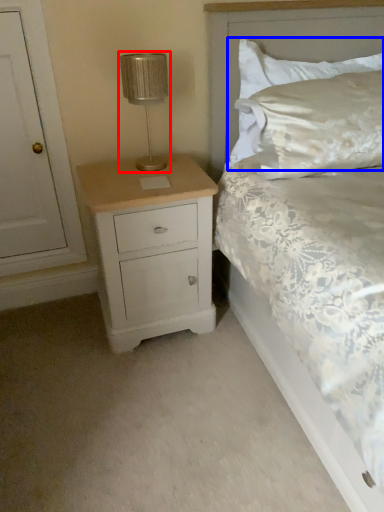
Question: Which object is closer to the camera taking this photo, table lamp (highlighted by a red box) or pillow (highlighted by a blue box)?

Choices:
 (A) table lamp
 (B) pillow

Answer: (A)